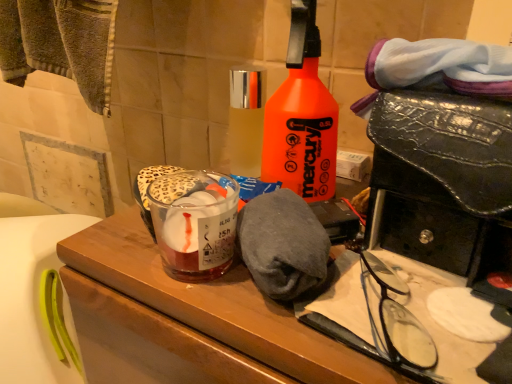
Find the location of `empty space that is ontop of wooden vanity at center (from a real-world perspective)`. empty space that is ontop of wooden vanity at center (from a real-world perspective) is located at coordinates [x=289, y=302].